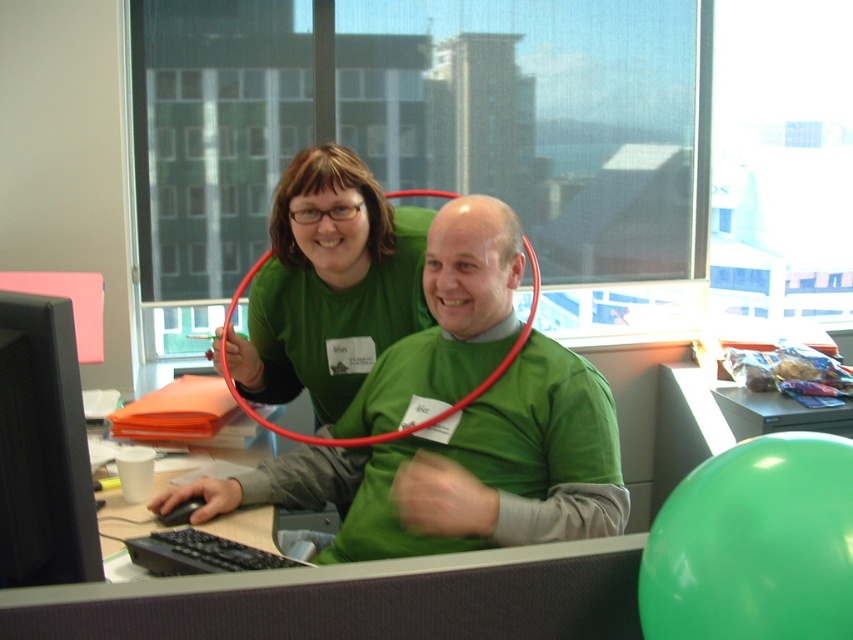
Does green matte shirt at center have a lesser width compared to black matte computer monitor at left?

No, green matte shirt at center is not thinner than black matte computer monitor at left.

Between green matte shirt at center and black matte computer monitor at left, which one appears on the right side from the viewer's perspective?

green matte shirt at center

Measure the distance between point (572, 404) and camera.

Point (572, 404) and camera are 1.60 meters apart.

The height and width of the screenshot is (640, 853). Find the location of `green matte shirt at center`. green matte shirt at center is located at coordinates (460, 472).